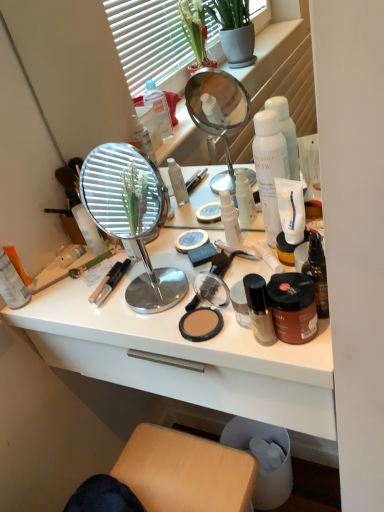
Question: Is white matte pump bottle at center, the 2th toiletry positioned from the left, wider or thinner than shiny brown bottle at right, which is the 1th toiletry in right-to-left order?

Choices:
 (A) wide
 (B) thin

Answer: (A)

Question: In the image, is white matte pump bottle at center, the 2th toiletry positioned from the left, positioned in front of or behind shiny brown bottle at right, which is the 1th toiletry in right-to-left order?

Choices:
 (A) behind
 (B) front

Answer: (A)

Question: Estimate the real-world distances between objects in this image. Which object is closer to the silver/metallic mirror at center?

Choices:
 (A) orange matte lotion at left, the 5th toiletry positioned from the right
 (B) matte black compact at center
 (C) shiny brown bottle at right, which is the 1th toiletry in right-to-left order
 (D) white matte pump bottle at center, the 2th toiletry positioned from the left
 (E) white glossy desk at center

Answer: (E)

Question: Which is nearer to the shiny brown bottle at right, the 5th toiletry viewed from the left?

Choices:
 (A) silver/metallic mirror at center
 (B) white glossy desk at center
 (C) matte black foundation at center, placed as the 3th toiletry when sorted from left to right
 (D) orange matte lotion at left, the 5th toiletry positioned from the right
 (E) brown matte jar at center-right, the fourth toiletry positioned from the left

Answer: (E)